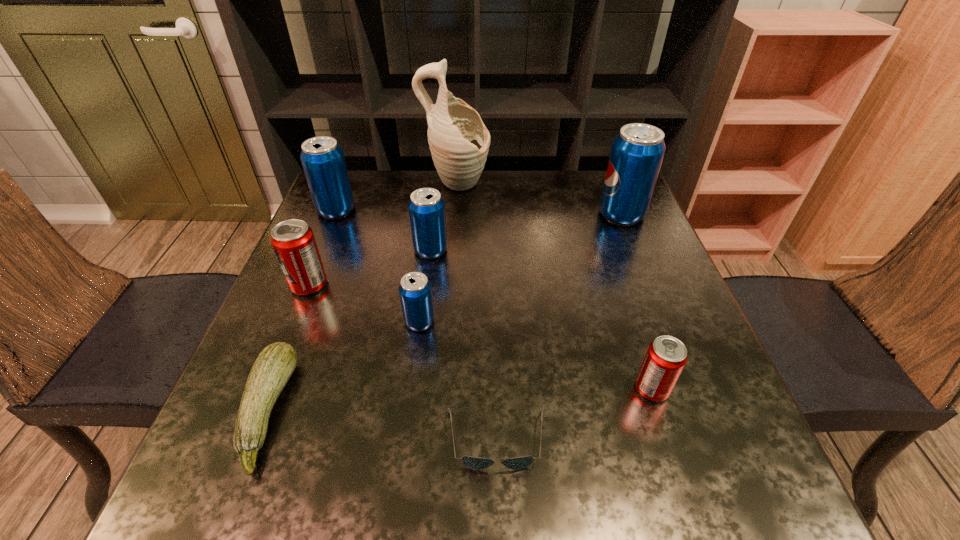
This screenshot has width=960, height=540. I want to click on the second closest object to the nearest blue pop soda, so click(x=476, y=463).

Identify which soda can is located as the fourth nearest to the fifth farthest object. Please provide its 2D coordinates. Your answer should be formatted as a tuple, i.e. [(x, y)], where the tuple contains the x and y coordinates of a point satisfying the conditions above.

[(666, 356)]

This screenshot has width=960, height=540. What are the coordinates of `soda can that is the fourth closest one to the left red soda can` in the screenshot? It's located at (666, 356).

The height and width of the screenshot is (540, 960). Identify the location of the fourth closest blue pop soda to the second shortest object. (637, 152).

Locate an element on the screen. blue pop soda that can be found as the third closest to the leftmost blue pop soda is located at coordinates (637, 152).

Where is `vacant region that satisfies the following two spatial constraints: 1. on the front side of the rightmost blue pop soda; 2. at the stem end of the green zucchini`? The height and width of the screenshot is (540, 960). vacant region that satisfies the following two spatial constraints: 1. on the front side of the rightmost blue pop soda; 2. at the stem end of the green zucchini is located at coordinates (701, 411).

Find the location of a particular element. vacant space that satisfies the following two spatial constraints: 1. at the spout of the pitcher; 2. on the left side of the nearest soda can is located at coordinates (442, 389).

The height and width of the screenshot is (540, 960). I want to click on free space that satisfies the following two spatial constraints: 1. at the spout of the biggest blue pop soda; 2. on the right side of the pitcher, so click(x=454, y=214).

This screenshot has width=960, height=540. Find the location of `vacant point that satisfies the following two spatial constraints: 1. on the front side of the second tallest soda can; 2. on the right side of the farther red soda can`. vacant point that satisfies the following two spatial constraints: 1. on the front side of the second tallest soda can; 2. on the right side of the farther red soda can is located at coordinates (305, 285).